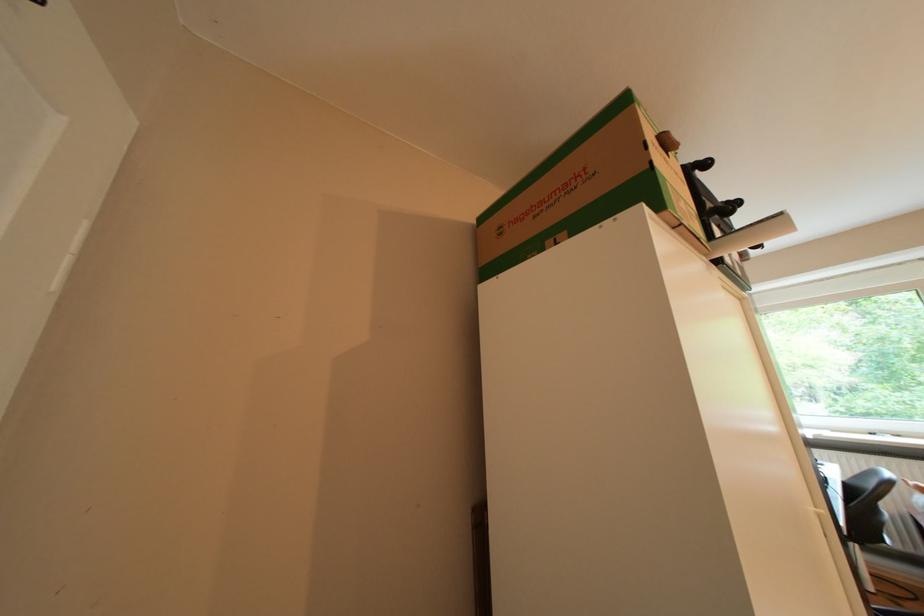
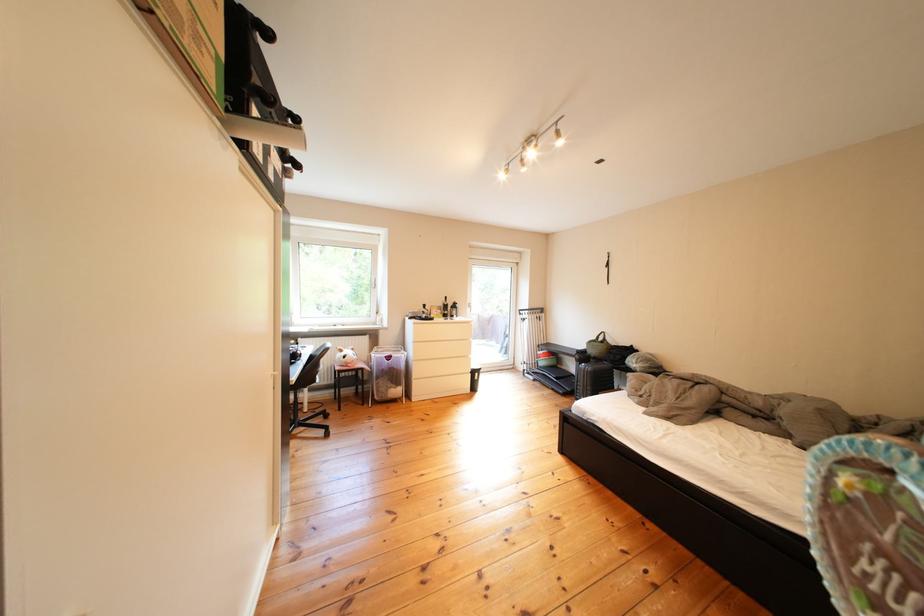
Question: The first image is from the beginning of the video and the second image is from the end. How did the camera likely rotate when shooting the video?

Choices:
 (A) Left
 (B) Right
 (C) Up
 (D) Down

Answer: (B)